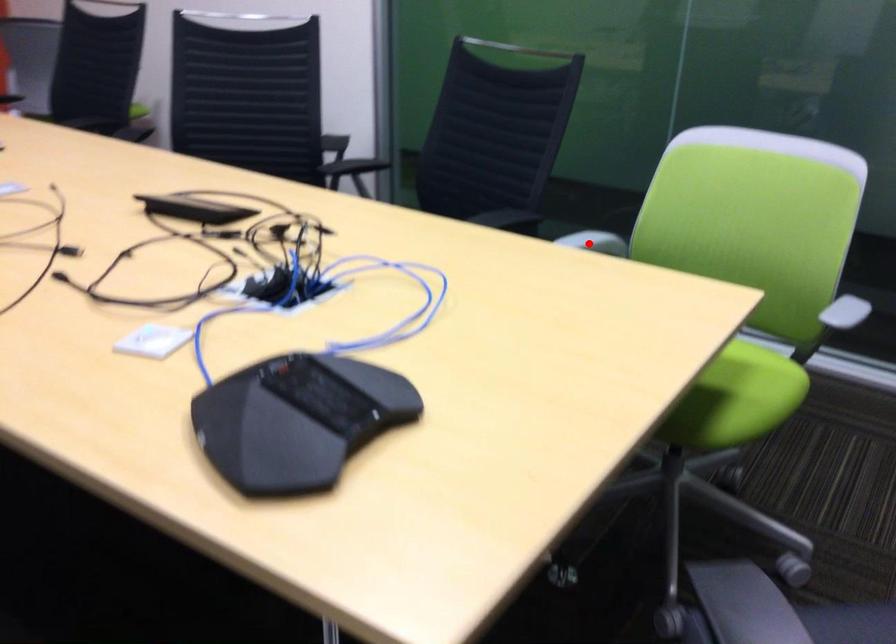
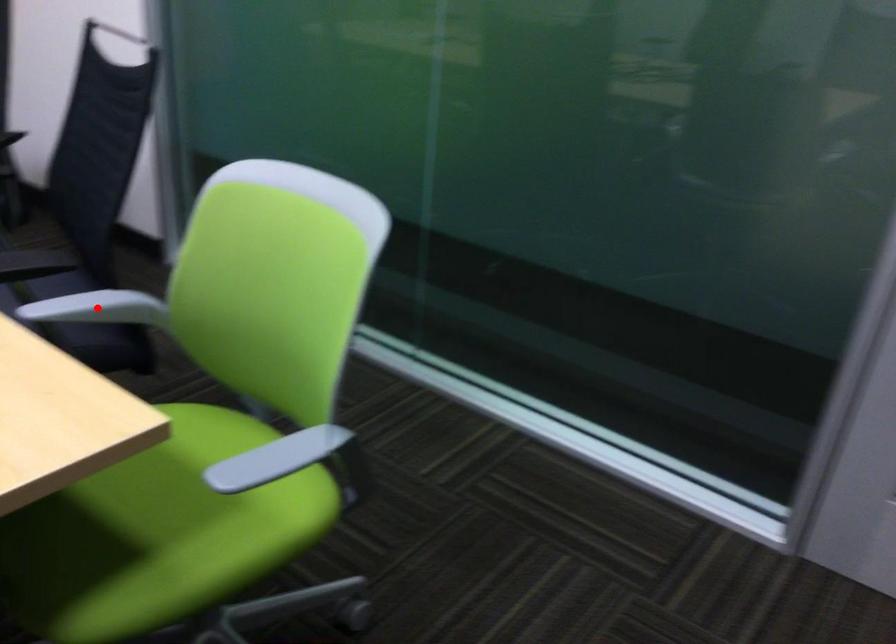
I am providing you with two images of the same scene from different viewpoints. A red point is marked on the first image and another point is marked on the second image. Does the point marked in image1 correspond to the same location as the one in image2?

Yes